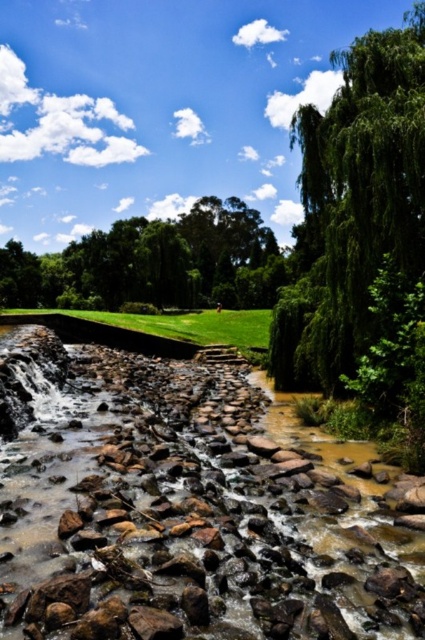
Looking at this image, does brown rocky creek at center appear over green grass at center?

No, brown rocky creek at center is not above green grass at center.

Can you confirm if brown rocky creek at center is wider than green grass at center?

No.

Find the location of a particular element. brown rocky creek at center is located at coordinates (180, 508).

Does green leafy tree at upper right have a lesser width compared to green leafy tree at center?

Yes.

Who is positioned more to the right, green leafy tree at upper right or green leafy tree at center?

From the viewer's perspective, green leafy tree at upper right appears more on the right side.

What do you see at coordinates (354, 204) in the screenshot? The height and width of the screenshot is (640, 425). I see `green leafy tree at upper right` at bounding box center [354, 204].

Identify the location of green leafy tree at upper right. Image resolution: width=425 pixels, height=640 pixels. (354, 204).

Looking at this image, between green leafy tree at center and green grass at center, which one appears on the right side from the viewer's perspective?

green grass at center is more to the right.

Consider the image. Does green leafy tree at center have a larger size compared to green grass at center?

Yes.

Between point (93, 248) and point (133, 323), which one is positioned in front?

Positioned in front is point (133, 323).

Identify the location of green leafy tree at center. The height and width of the screenshot is (640, 425). (153, 262).